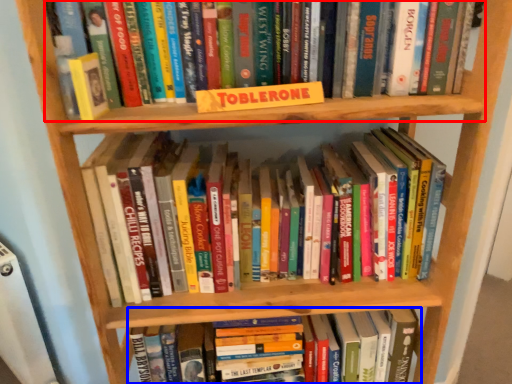
Question: Which object is further to the camera taking this photo, book (highlighted by a red box) or book (highlighted by a blue box)?

Choices:
 (A) book
 (B) book

Answer: (B)